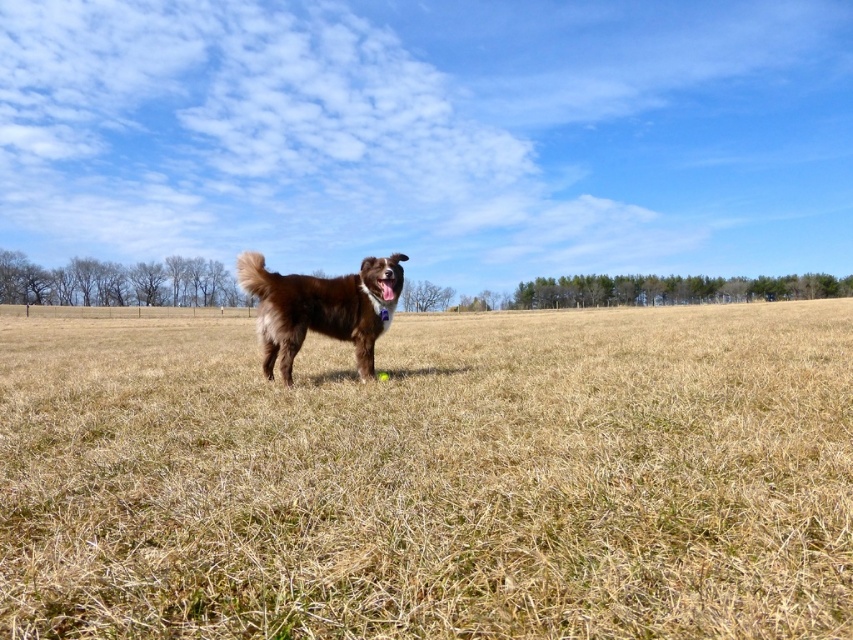
You are a photographer trying to capture a wide shot of the brown furry dog at center. Considering the dry grass at center is wider than the dog, how should you adjust your camera angle to ensure both the dog and the grass are fully visible in the frame?

Since the dry grass at center is wider than the brown furry dog at center, you should position your camera to focus on the dog while widening the frame to include the full width of the dry grass at center, ensuring both elements are captured without cropping either.

Where is the dry grass at center located in the image?

The dry grass at center is located at point (x=432, y=477) in the image.

You are a photographer trying to capture the brown furry dog at center in your shot. However, you notice the dry grass at center is blocking the view. Can you adjust your camera angle to see the dog clearly without moving the grass?

The dry grass at center is in front of the brown furry dog at center, so adjusting the camera angle to look around or above the dry grass at center would allow a clear view of the dog.